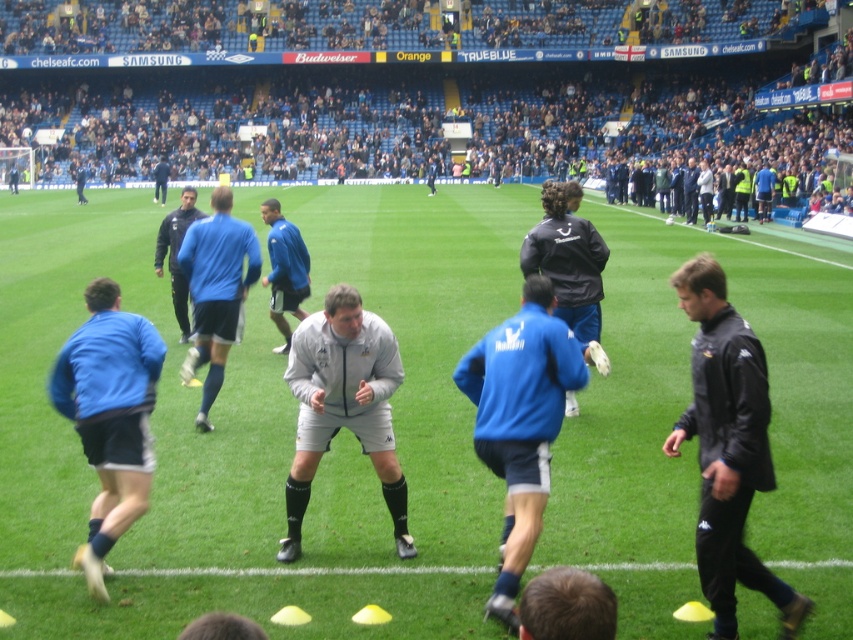
Question: Among these points, which one is farthest from the camera?

Choices:
 (A) (517, 394)
 (B) (767, 400)

Answer: (A)

Question: Where is blue matte jacket at center located in relation to dark blue jacket at center in the image?

Choices:
 (A) above
 (B) below

Answer: (B)

Question: Estimate the real-world distances between objects in this image. Which object is farther from the smooth green grass at center?

Choices:
 (A) gray fleece jacket at center
 (B) black leather jacket at center
 (C) blue fabric jacket at center

Answer: (B)

Question: Does smooth green grass at center have a larger size compared to gray fleece jacket at center?

Choices:
 (A) yes
 (B) no

Answer: (A)

Question: Can you confirm if gray fleece jacket at center is bigger than black leather jacket at center?

Choices:
 (A) yes
 (B) no

Answer: (A)

Question: Estimate the real-world distances between objects in this image. Which object is closer to the blue matte shorts at center?

Choices:
 (A) smooth green grass at center
 (B) black leather jacket at center
 (C) gray fleece jacket at center
 (D) blue fabric jacket at center

Answer: (D)